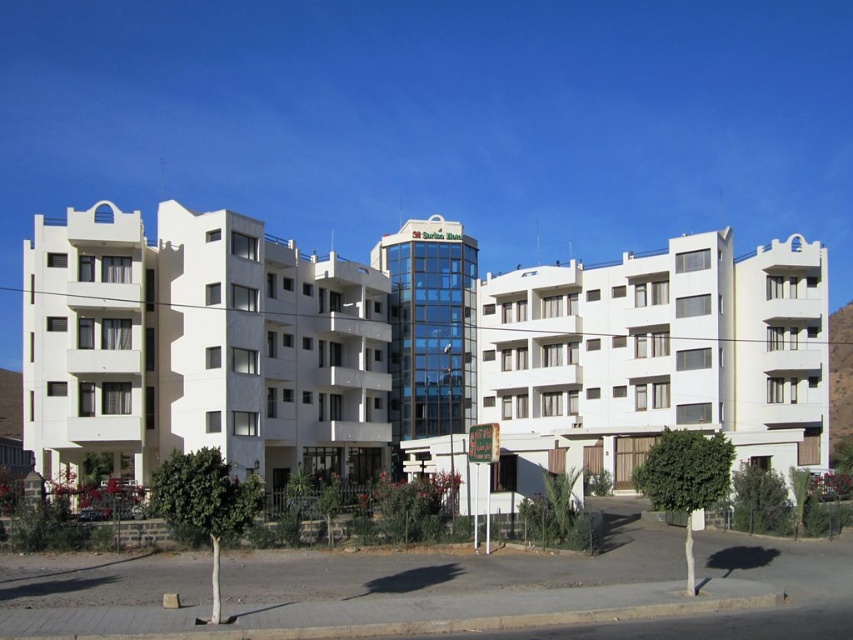
Question: Which object is farther from the camera taking this photo?

Choices:
 (A) white matte building at center
 (B) white smooth building at center
 (C) white smooth building at left

Answer: (C)

Question: Can you confirm if white smooth building at left is positioned to the right of white matte building at center?

Choices:
 (A) yes
 (B) no

Answer: (B)

Question: Which of the following is the closest to the observer?

Choices:
 (A) white smooth building at center
 (B) white smooth building at left
 (C) white matte building at center

Answer: (A)

Question: Does white smooth building at center have a smaller size compared to white smooth building at left?

Choices:
 (A) yes
 (B) no

Answer: (B)

Question: Can you confirm if white smooth building at left is wider than white matte building at center?

Choices:
 (A) no
 (B) yes

Answer: (B)

Question: Which point is farther to the camera?

Choices:
 (A) white smooth building at left
 (B) white matte building at center
 (C) white smooth building at center

Answer: (A)